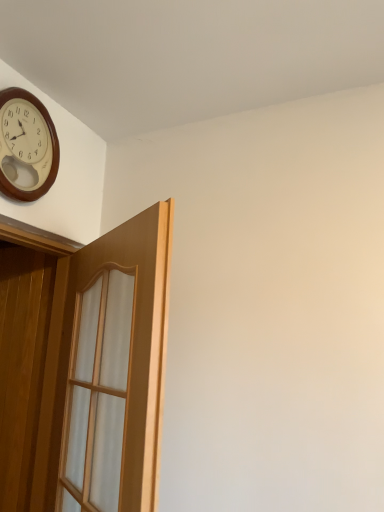
Question: Is light brown wood door at upper left turned away from wooden clock at upper left?

Choices:
 (A) no
 (B) yes

Answer: (A)

Question: Can you confirm if light brown wood door at upper left is wider than wooden clock at upper left?

Choices:
 (A) yes
 (B) no

Answer: (A)

Question: Can you confirm if light brown wood door at upper left is positioned to the right of wooden clock at upper left?

Choices:
 (A) no
 (B) yes

Answer: (B)

Question: Can you confirm if light brown wood door at upper left is shorter than wooden clock at upper left?

Choices:
 (A) yes
 (B) no

Answer: (B)

Question: From the image's perspective, is light brown wood door at upper left over wooden clock at upper left?

Choices:
 (A) yes
 (B) no

Answer: (B)

Question: From the image's perspective, is light brown wood door at upper left beneath wooden clock at upper left?

Choices:
 (A) yes
 (B) no

Answer: (A)

Question: Can you confirm if wooden clock at upper left is thinner than light brown wood door at upper left?

Choices:
 (A) yes
 (B) no

Answer: (A)

Question: From the image's perspective, would you say wooden clock at upper left is shown under light brown wood door at upper left?

Choices:
 (A) yes
 (B) no

Answer: (B)

Question: Is wooden clock at upper left aimed at light brown wood door at upper left?

Choices:
 (A) no
 (B) yes

Answer: (A)

Question: Does wooden clock at upper left come behind light brown wood door at upper left?

Choices:
 (A) no
 (B) yes

Answer: (B)

Question: From a real-world perspective, is wooden clock at upper left physically below light brown wood door at upper left?

Choices:
 (A) yes
 (B) no

Answer: (B)

Question: Is wooden clock at upper left in contact with light brown wood door at upper left?

Choices:
 (A) no
 (B) yes

Answer: (A)

Question: In the image, is wooden clock at upper left on the left side or the right side of light brown wood door at upper left?

Choices:
 (A) right
 (B) left

Answer: (B)